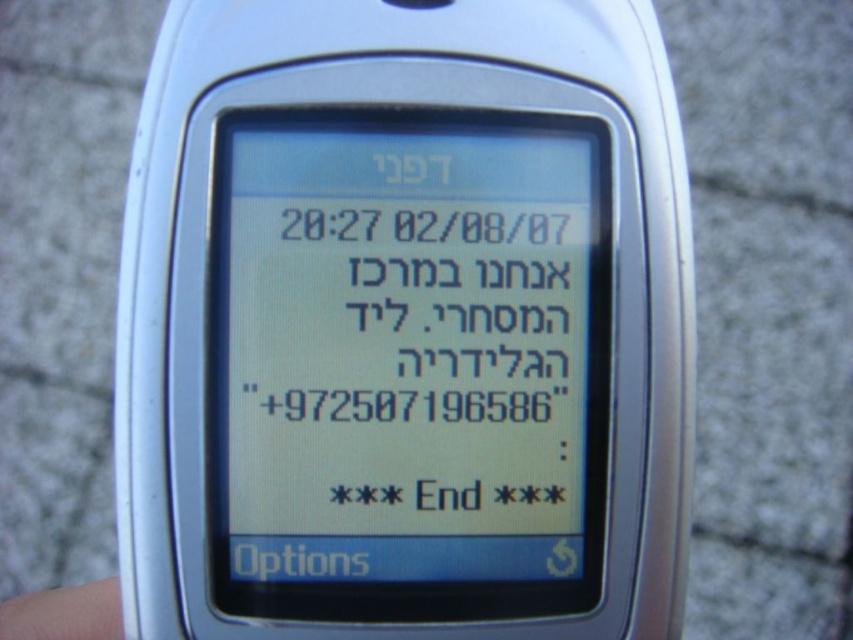
You are a photographer trying to capture the silver metallic phone at center and the skin smooth finger at lower left in a single frame. Based on their sizes, which object will appear larger in the photo?

The silver metallic phone at center will appear larger in the photo because it has a greater height compared to the skin smooth finger at lower left.

You are a delivery driver who needs to deliver a package to a location marked by the point at (252, 348). The delivery truck is parked 27.13 inches away from this point. Can you reach the delivery point from your current position without moving the truck?

The point at (252, 348) is 27.13 inches away from the delivery truck. Since the truck is parked 27.13 inches away, you can reach the delivery point without moving the truck as the distance matches.

You are a delivery robot with a 12 inch arm. You need to pick up the skin smooth finger at lower left and place it on the white matte text message at center. Can your arm reach that far?

The distance between the white matte text message at center and the skin smooth finger at lower left is 14.77 inches. Since your arm is only 12 inches long, it cannot reach that distance.